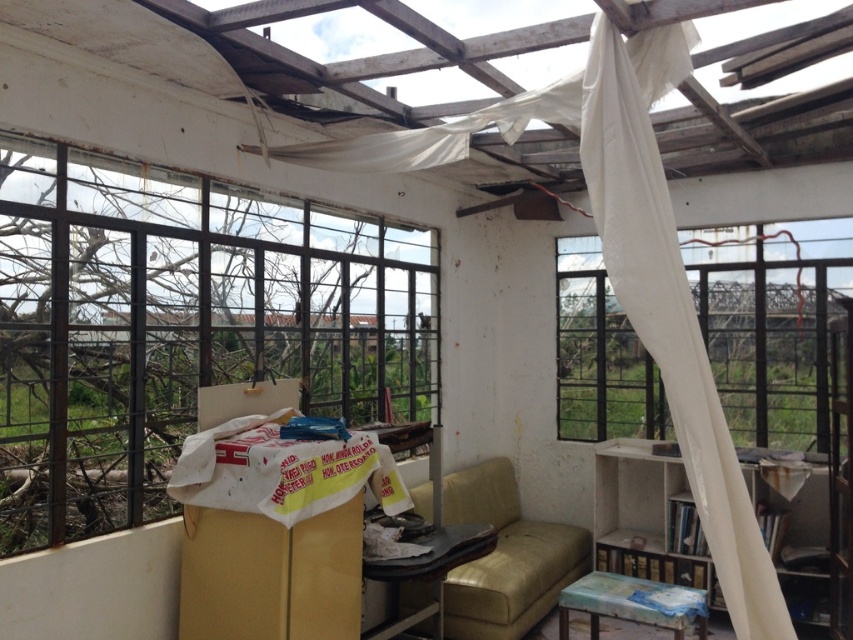
Question: Which of the following is the farthest from the observer?

Choices:
 (A) matte green cushion at lower center
 (B) clear glass window at center

Answer: (A)

Question: Estimate the real-world distances between objects in this image. Which object is closer to the leather-like green sofa at center?

Choices:
 (A) white fabric curtain at upper right
 (B) leather couch at center

Answer: (B)

Question: Is the position of white fabric curtain at upper right less distant than that of leather couch at center?

Choices:
 (A) yes
 (B) no

Answer: (A)

Question: Does clear glass window at center have a lesser width compared to transparent plastic window at right?

Choices:
 (A) yes
 (B) no

Answer: (B)

Question: Does clear glass window at center have a greater width compared to wooden bookshelf at lower right?

Choices:
 (A) yes
 (B) no

Answer: (A)

Question: Which point is closer to the camera?

Choices:
 (A) (735, 621)
 (B) (563, 624)
 (C) (584, 305)

Answer: (A)